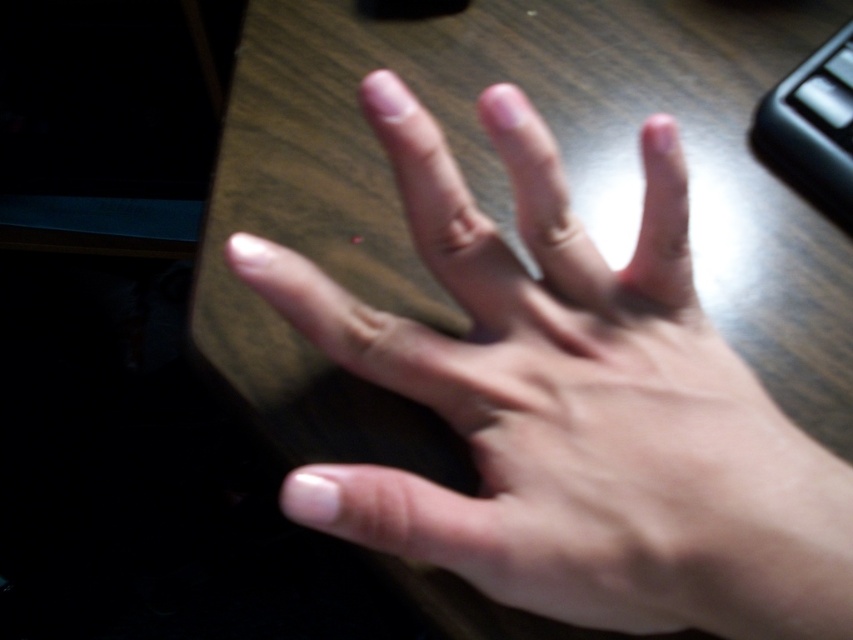
Question: Is smooth skin hand at center bigger than black plastic keyboard at upper right?

Choices:
 (A) yes
 (B) no

Answer: (A)

Question: Which object appears closest to the camera in this image?

Choices:
 (A) black plastic keyboard at upper right
 (B) smooth skin hand at center

Answer: (B)

Question: Does smooth skin hand at center appear on the right side of black plastic keyboard at upper right?

Choices:
 (A) yes
 (B) no

Answer: (B)

Question: Which object is closer to the camera taking this photo?

Choices:
 (A) smooth skin hand at center
 (B) black plastic keyboard at upper right

Answer: (A)

Question: Is smooth skin hand at center to the left of black plastic keyboard at upper right from the viewer's perspective?

Choices:
 (A) yes
 (B) no

Answer: (A)